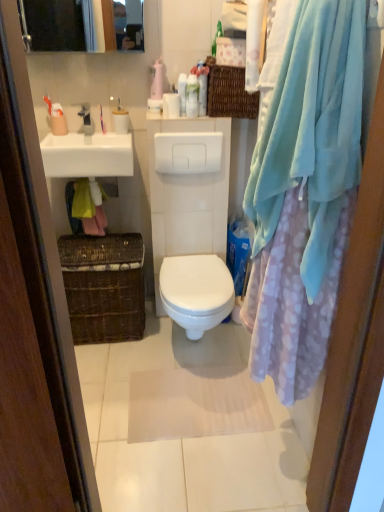
What are the coordinates of `vacant area that is in front of satin silver faucet at upper center` in the screenshot? It's located at (82, 142).